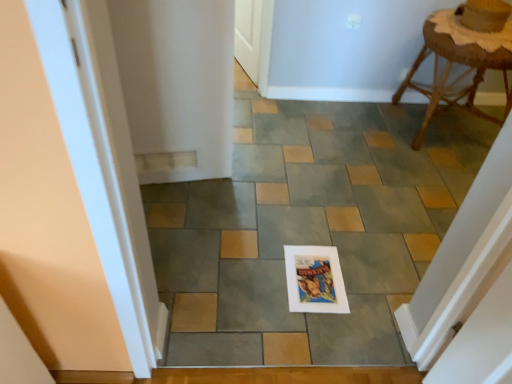
What do you see at coordinates (456, 78) in the screenshot? I see `rattan stool at upper right` at bounding box center [456, 78].

Locate an element on the screen. rattan stool at upper right is located at coordinates (456, 78).

What is the approximate height of rattan stool at upper right?

It is 57.44 centimeters.

Measure the distance between rattan stool at upper right and camera.

rattan stool at upper right is 6.19 feet away from camera.

The height and width of the screenshot is (384, 512). Identify the location of white paper at center. (308, 229).

Measure the distance between white paper at center and camera.

white paper at center and camera are 1.31 meters apart.

Consider the image. In order to face white paper at center, should I rotate leftwards or rightwards?

Turn right approximately 14.312 degrees to face it.

The width and height of the screenshot is (512, 384). What do you see at coordinates (308, 229) in the screenshot? I see `white paper at center` at bounding box center [308, 229].

Where is `rattan stool at upper right`? rattan stool at upper right is located at coordinates (456, 78).

Does rattan stool at upper right appear on the right side of white paper at center?

Correct, you'll find rattan stool at upper right to the right of white paper at center.

Which is in front, rattan stool at upper right or white paper at center?

white paper at center is in front.

Which is farther, (452, 89) or (277, 138)?

Point (452, 89)

From the image's perspective, is rattan stool at upper right positioned above or below white paper at center?

rattan stool at upper right is above white paper at center.

From a real-world perspective, which object rests below the other?

In real-world perspective, white paper at center is lower.

Is rattan stool at upper right wider than white paper at center?

No.

In terms of height, does rattan stool at upper right look taller or shorter compared to white paper at center?

rattan stool at upper right is taller than white paper at center.

In the scene shown: Does rattan stool at upper right have a smaller size compared to white paper at center?

Yes, rattan stool at upper right is smaller than white paper at center.

In the scene shown: Is white paper at center completely or partially inside rattan stool at upper right?

No, white paper at center is not surrounded by rattan stool at upper right.

Is rattan stool at upper right placed right next to white paper at center?

No, rattan stool at upper right is not beside white paper at center.

Is rattan stool at upper right positioned with its back to white paper at center?

No, rattan stool at upper right is not facing the opposite direction of white paper at center.

In the scene shown: How different are the orientations of rattan stool at upper right and white paper at center in degrees?

0.575 degrees.

In order to click on path below the rattan stool at upper right (from the image's perspective) in this screenshot , I will do `click(308, 229)`.

Is white paper at center to the left or to the right of rattan stool at upper right in the image?

white paper at center is positioned on rattan stool at upper right's left side.

Is white paper at center in front of rattan stool at upper right?

That is True.

Is point (442, 146) positioned before point (467, 104)?

Yes, it is.

From the image's perspective, is white paper at center above rattan stool at upper right?

Actually, white paper at center appears below rattan stool at upper right in the image.

From a real-world perspective, is white paper at center physically located above or below rattan stool at upper right?

Clearly, from a real-world perspective, white paper at center is below rattan stool at upper right.

Which object is wider, white paper at center or rattan stool at upper right?

Wider between the two is white paper at center.

Does white paper at center have a greater height compared to rattan stool at upper right?

No, white paper at center is not taller than rattan stool at upper right.

Does white paper at center have a larger size compared to rattan stool at upper right?

Indeed, white paper at center has a larger size compared to rattan stool at upper right.

Is rattan stool at upper right completely or partially inside white paper at center?

No, white paper at center does not contain rattan stool at upper right.

Are white paper at center and rattan stool at upper right making contact?

white paper at center and rattan stool at upper right are clearly separated.

Based on the photo, is white paper at center looking in the opposite direction of rattan stool at upper right?

No, white paper at center's orientation is not away from rattan stool at upper right.

Can you tell me how much white paper at center and rattan stool at upper right differ in facing direction?

The angle between the facing direction of white paper at center and the facing direction of rattan stool at upper right is 0.575 degrees.

How much distance is there between white paper at center and rattan stool at upper right?

white paper at center is 59.86 centimeters away from rattan stool at upper right.

You are a GUI agent. You are given a task and a screenshot of the screen. Output one action in this format:
    pyautogui.click(x=<x>, y=<y>)
    Task: Click on the path on the left of rattan stool at upper right
    
    Given the screenshot: What is the action you would take?
    pyautogui.click(x=308, y=229)

This screenshot has height=384, width=512. I want to click on path that is on the left side of rattan stool at upper right, so [x=308, y=229].

The width and height of the screenshot is (512, 384). I want to click on path that is in front of the rattan stool at upper right, so click(x=308, y=229).